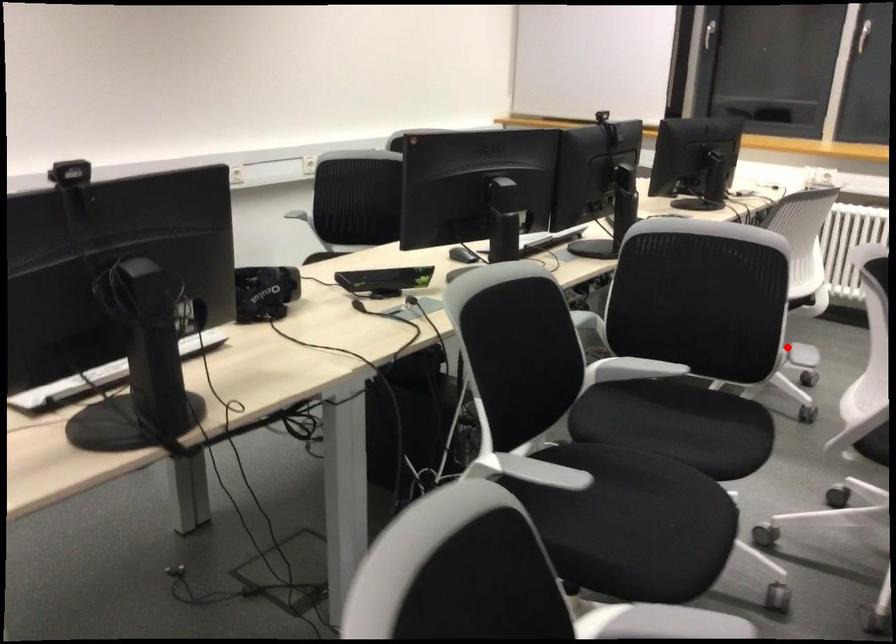
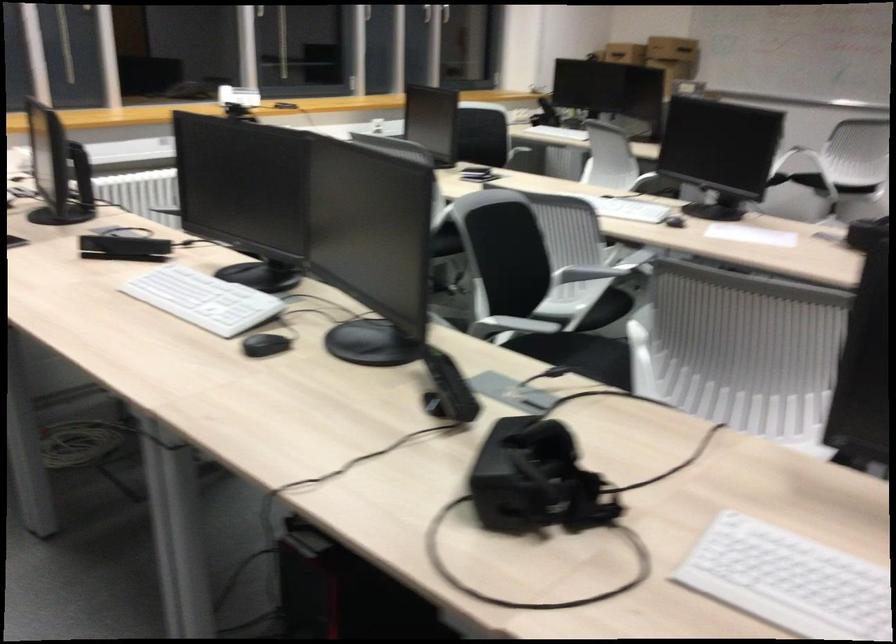
Locate, in the second image, the point that corresponds to the highlighted location in the first image.

(586, 272)